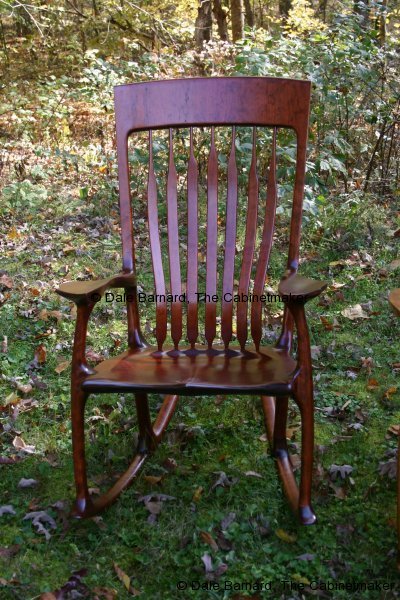
You are a GUI agent. You are given a task and a screenshot of the screen. Output one action in this format:
    pyautogui.click(x=<x>, y=<y>)
    Task: Click on the right armrest of rocking chair
    This screenshot has height=600, width=400.
    Given the screenshot: What is the action you would take?
    pyautogui.click(x=81, y=283)